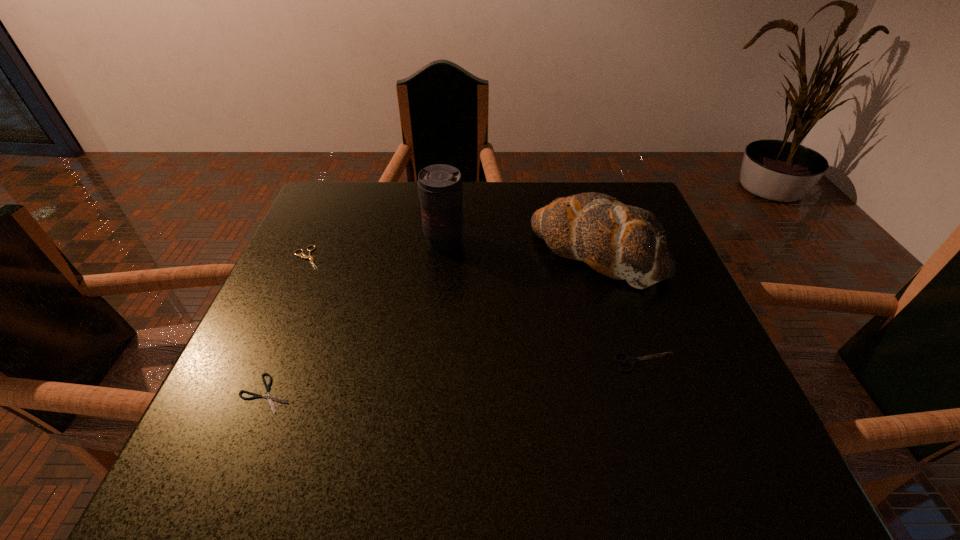
The image size is (960, 540). Identify the location of vacant region located 0.080m on the front of the bread. (616, 320).

Where is `free space located 0.190m on the back of the tallest shears`? This screenshot has height=540, width=960. free space located 0.190m on the back of the tallest shears is located at coordinates (619, 284).

Where is `blank space located 0.360m on the front of the second shortest object`? The height and width of the screenshot is (540, 960). blank space located 0.360m on the front of the second shortest object is located at coordinates (241, 410).

Locate an element on the screen. The width and height of the screenshot is (960, 540). vacant space located 0.200m on the right of the shortest shears is located at coordinates (405, 394).

Locate an element on the screen. telephoto lens located at the far edge is located at coordinates (440, 187).

Where is `bread that is at the far edge`? bread that is at the far edge is located at coordinates (620, 241).

Find the location of `bread situated at the right edge`. bread situated at the right edge is located at coordinates (620, 241).

You are a GUI agent. You are given a task and a screenshot of the screen. Output one action in this format:
    pyautogui.click(x=<x>, y=<y>)
    Task: Click on the shears that is at the right edge
    
    Given the screenshot: What is the action you would take?
    pyautogui.click(x=630, y=361)

The width and height of the screenshot is (960, 540). In order to click on object that is at the far right corner in this screenshot , I will do `click(620, 241)`.

This screenshot has height=540, width=960. In the image, there is a desktop. In order to click on vacant region at the far edge in this screenshot , I will do `click(482, 231)`.